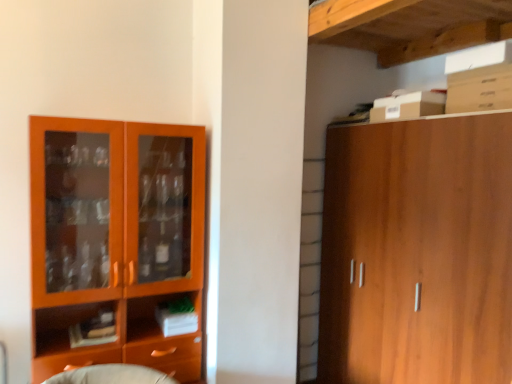
What do you see at coordinates (115, 239) in the screenshot? Image resolution: width=512 pixels, height=384 pixels. I see `orange wood cabinet at left` at bounding box center [115, 239].

This screenshot has height=384, width=512. Describe the element at coordinates (408, 106) in the screenshot. I see `white cardboard box at upper right` at that location.

You are a GUI agent. You are given a task and a screenshot of the screen. Output one action in this format:
    pyautogui.click(x=<x>, y=<y>)
    Task: Click on the orange wood cabinet at left
    
    Given the screenshot: What is the action you would take?
    pos(115,239)

From the picture: Does white cardboard box at upper right have a lesser width compared to wooden cabinet at right?

Yes, white cardboard box at upper right is thinner than wooden cabinet at right.

Could you tell me if white cardboard box at upper right is facing wooden cabinet at right?

No, white cardboard box at upper right is not aimed at wooden cabinet at right.

From the image's perspective, which one is positioned lower, white cardboard box at upper right or wooden cabinet at right?

wooden cabinet at right is shown below in the image.

Can you tell me how much white cardboard box at upper right and wooden cabinet at right differ in facing direction?

They differ by 0.000514 degrees in their facing directions.

In order to click on cupboard behind the wooden cabinet at right in this screenshot , I will do `click(115, 239)`.

Is wooden cabinet at right thinner than orange wood cabinet at left?

No.

Is wooden cabinet at right not near orange wood cabinet at left?

wooden cabinet at right is far away from orange wood cabinet at left.

Is wooden cabinet at right taller or shorter than orange wood cabinet at left?

wooden cabinet at right is taller than orange wood cabinet at left.

Which is more to the left, orange wood cabinet at left or white cardboard box at upper right?

From the viewer's perspective, orange wood cabinet at left appears more on the left side.

From a real-world perspective, between orange wood cabinet at left and white cardboard box at upper right, who is vertically higher?

In real-world perspective, white cardboard box at upper right is above.

Looking at this image, which is less distant, (56, 256) or (404, 94)?

The point (56, 256) is in front.

Could you tell me if orange wood cabinet at left is turned towards white cardboard box at upper right?

No, orange wood cabinet at left is not turned towards white cardboard box at upper right.

Considering the sizes of objects wooden cabinet at right and white cardboard box at upper right in the image provided, who is taller, wooden cabinet at right or white cardboard box at upper right?

Standing taller between the two is wooden cabinet at right.

Can you tell me how much wooden cabinet at right and white cardboard box at upper right differ in facing direction?

wooden cabinet at right and white cardboard box at upper right are facing 0.000514 degrees away from each other.

Considering the relative positions of wooden cabinet at right and white cardboard box at upper right in the image provided, is wooden cabinet at right to the right of white cardboard box at upper right from the viewer's perspective?

Yes.

Based on the photo, would you consider orange wood cabinet at left to be distant from wooden cabinet at right?

Yes, orange wood cabinet at left is far from wooden cabinet at right.

Is orange wood cabinet at left spatially inside wooden cabinet at right, or outside of it?

orange wood cabinet at left is not enclosed by wooden cabinet at right.

Considering the relative positions of orange wood cabinet at left and wooden cabinet at right in the image provided, is orange wood cabinet at left to the left or to the right of wooden cabinet at right?

Based on their positions, orange wood cabinet at left is located to the left of wooden cabinet at right.

Which object is closer to the camera, orange wood cabinet at left or wooden cabinet at right?

wooden cabinet at right.

From a real-world perspective, between white cardboard box at upper right and orange wood cabinet at left, who is vertically lower?

orange wood cabinet at left, from a real-world perspective.

From the image's perspective, is white cardboard box at upper right located above or below orange wood cabinet at left?

Clearly, from the image's perspective, white cardboard box at upper right is above orange wood cabinet at left.

Considering the sizes of white cardboard box at upper right and orange wood cabinet at left in the image, is white cardboard box at upper right wider or thinner than orange wood cabinet at left?

Clearly, white cardboard box at upper right has less width compared to orange wood cabinet at left.

Find the location of a particular element. The width and height of the screenshot is (512, 384). cabinetry that is in front of the white cardboard box at upper right is located at coordinates (417, 252).

This screenshot has width=512, height=384. Identify the location of cupboard above the wooden cabinet at right (from a real-world perspective). (115, 239).

Estimate the real-world distances between objects in this image. Which object is further from wooden cabinet at right, orange wood cabinet at left or white cardboard box at upper right?

Based on the image, orange wood cabinet at left appears to be further to wooden cabinet at right.

From the image, which object appears to be farther from white cardboard box at upper right, wooden cabinet at right or orange wood cabinet at left?

Based on the image, orange wood cabinet at left appears to be further to white cardboard box at upper right.

Looking at this image, from the image, which object appears to be farther from orange wood cabinet at left, wooden cabinet at right or white cardboard box at upper right?

The object further to orange wood cabinet at left is white cardboard box at upper right.

From the image, which object appears to be farther from orange wood cabinet at left, white cardboard box at upper right or wooden cabinet at right?

Among the two, white cardboard box at upper right is located further to orange wood cabinet at left.

Looking at the image, which one is located further to white cardboard box at upper right, orange wood cabinet at left or wooden cabinet at right?

orange wood cabinet at left is positioned further to the anchor white cardboard box at upper right.

Estimate the real-world distances between objects in this image. Which object is further from wooden cabinet at right, white cardboard box at upper right or orange wood cabinet at left?

orange wood cabinet at left is positioned further to the anchor wooden cabinet at right.

The height and width of the screenshot is (384, 512). I want to click on cardboard box between orange wood cabinet at left and wooden cabinet at right, so click(408, 106).